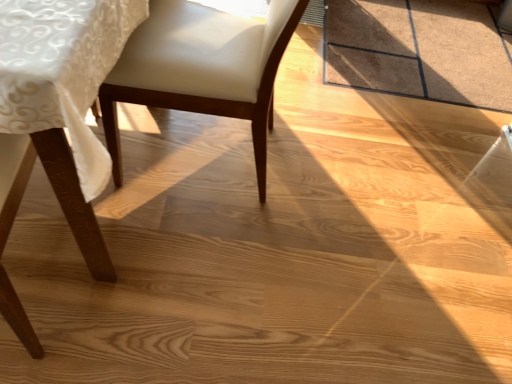
Question: Is white leather chair at center, positioned as the second chair in left-to-right order, wider than matte wood chair at lower left, the 1th chair from the left?

Choices:
 (A) yes
 (B) no

Answer: (B)

Question: Considering the relative sizes of white leather chair at center, the 1th chair from the right, and matte wood chair at lower left, the second chair positioned from the right, in the image provided, is white leather chair at center, the 1th chair from the right, shorter than matte wood chair at lower left, the second chair positioned from the right,?

Choices:
 (A) no
 (B) yes

Answer: (A)

Question: Can you confirm if white leather chair at center, the 1th chair from the right, is taller than matte wood chair at lower left, the 1th chair from the left?

Choices:
 (A) no
 (B) yes

Answer: (B)

Question: From a real-world perspective, is white leather chair at center, positioned as the second chair in left-to-right order, located beneath matte wood chair at lower left, the 1th chair from the left?

Choices:
 (A) no
 (B) yes

Answer: (A)

Question: From the image's perspective, is white leather chair at center, the 1th chair from the right, under matte wood chair at lower left, the 1th chair from the left?

Choices:
 (A) no
 (B) yes

Answer: (A)

Question: Is white leather chair at center, the 1th chair from the right, facing away from matte wood chair at lower left, the second chair positioned from the right?

Choices:
 (A) yes
 (B) no

Answer: (B)

Question: Can you confirm if matte wood chair at lower left, the second chair positioned from the right, is smaller than white leather chair at center, the 1th chair from the right?

Choices:
 (A) yes
 (B) no

Answer: (B)

Question: Considering the relative sizes of matte wood chair at lower left, the 1th chair from the left, and white leather chair at center, positioned as the second chair in left-to-right order, in the image provided, is matte wood chair at lower left, the 1th chair from the left, thinner than white leather chair at center, positioned as the second chair in left-to-right order,?

Choices:
 (A) no
 (B) yes

Answer: (A)

Question: Is matte wood chair at lower left, the second chair positioned from the right, at the left side of white leather chair at center, the 1th chair from the right?

Choices:
 (A) yes
 (B) no

Answer: (A)

Question: Is matte wood chair at lower left, the 1th chair from the left, looking in the opposite direction of white leather chair at center, the 1th chair from the right?

Choices:
 (A) yes
 (B) no

Answer: (B)

Question: Is matte wood chair at lower left, the 1th chair from the left, wider than white leather chair at center, the 1th chair from the right?

Choices:
 (A) yes
 (B) no

Answer: (A)

Question: Does matte wood chair at lower left, the second chair positioned from the right, have a greater height compared to white leather chair at center, positioned as the second chair in left-to-right order?

Choices:
 (A) yes
 (B) no

Answer: (B)

Question: Is matte wood chair at lower left, the second chair positioned from the right, taller or shorter than white leather chair at center, positioned as the second chair in left-to-right order?

Choices:
 (A) tall
 (B) short

Answer: (B)